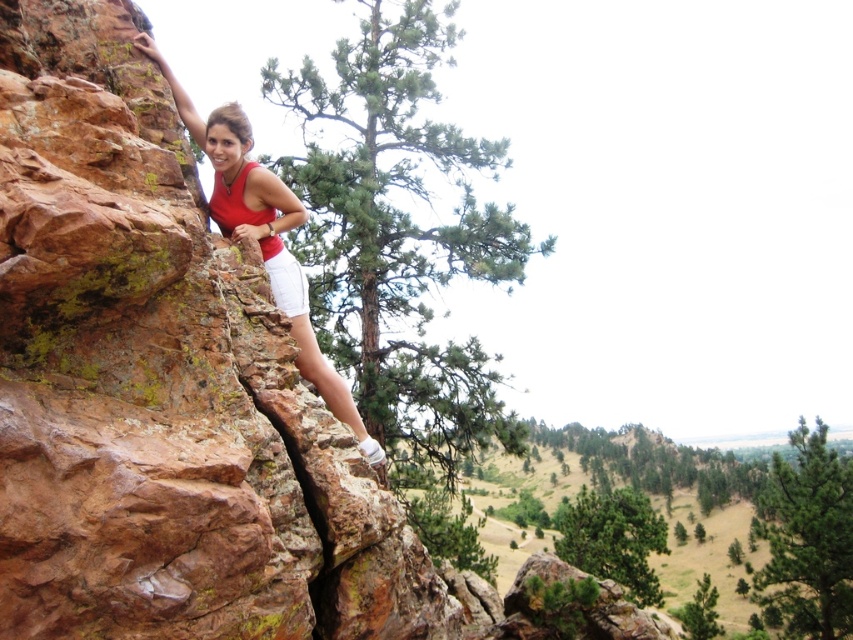
You are a photographer trying to capture the climber and the pine tree in the background. Given that the green matte pine at upper center and the matte red tank top at center are both in your viewfinder, which object would appear larger in the photo?

The green matte pine at upper center would appear larger in the photo because it is bigger than the matte red tank top at center.

You are a hiker trying to locate the green matte pine in the image. The climber is at point 0.0, 0.0. The coordinate system is normalized, with 0.0 being the bottom left corner and 1.0 the top right corner. Which direction should you look from the climber to find the green matte pine at point (807, 540)?

The green matte pine at upper center is located at point (807, 540), which is to the upper right direction from the climber at 0.0, 0.0.

You are a photographer trying to capture the climber in the image. You notice the matte red tank top at center and the white cotton shorts at center. Which piece of clothing will appear larger in your photo?

The matte red tank top at center will appear larger in the photo because it is closer to the viewer than the white cotton shorts at center.